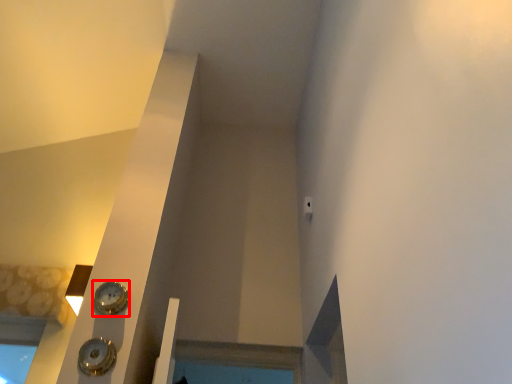
Question: Where is clock (annotated by the red box) located in relation to clock in the image?

Choices:
 (A) right
 (B) left

Answer: (A)